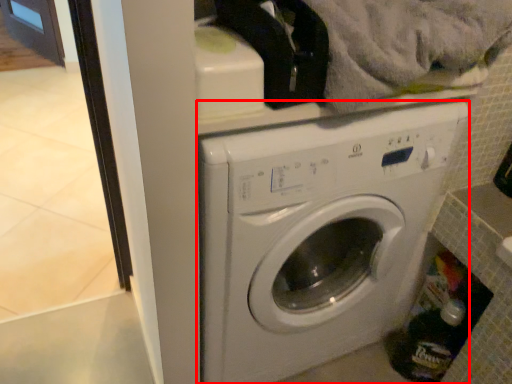
Question: In this image, where is washing machine (annotated by the red box) located relative to bottle?

Choices:
 (A) right
 (B) left

Answer: (B)